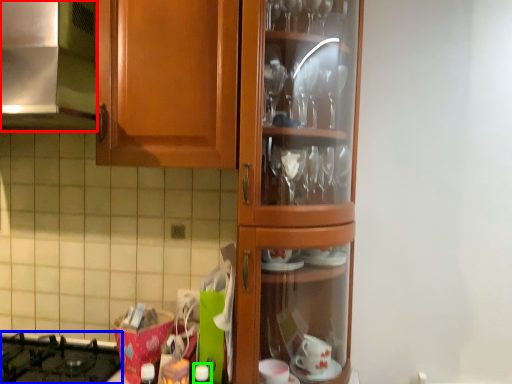
Question: Estimate the real-world distances between objects in this image. Which object is farther from exhaust hood (highlighted by a red box), gas stove (highlighted by a blue box) or bottle (highlighted by a green box)?

Choices:
 (A) gas stove
 (B) bottle

Answer: (B)